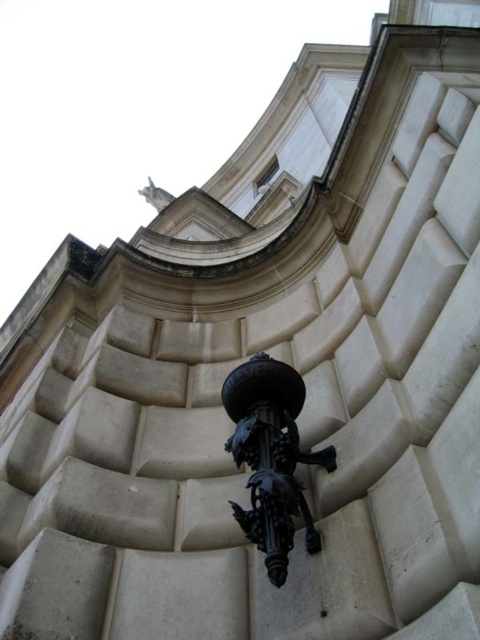
You are an architect analyzing the classical building facade. You notice the black wrought iron at center and the white stone statue at upper center. Which object is shorter in height?

The black wrought iron at center has a lesser height compared to the white stone statue at upper center, so the black wrought iron at center is shorter.

You are an architect examining the classical structure. You need to determine which object has a greater width between the black wrought iron at center and the white stone statue at upper center based on the scene. What is your conclusion?

The black wrought iron at center is thinner than the white stone statue at upper center, so the white stone statue at upper center has a greater width.